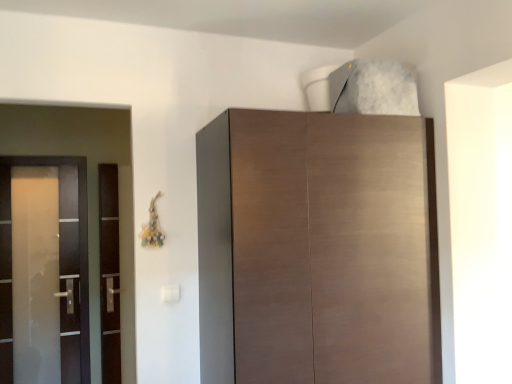
Find the location of a particular element. This screenshot has height=384, width=512. matte brown cabinet at upper center is located at coordinates (317, 249).

This screenshot has height=384, width=512. Describe the element at coordinates (109, 273) in the screenshot. I see `transparent glass door at left, which is counted as the 2th screen door, starting from the left` at that location.

Find the location of a particular element. Image resolution: width=512 pixels, height=384 pixels. matte brown cabinet at upper center is located at coordinates (317, 249).

Where is `screen door on the right of satin glass screen door at left, positioned as the first screen door in left-to-right order`? The width and height of the screenshot is (512, 384). screen door on the right of satin glass screen door at left, positioned as the first screen door in left-to-right order is located at coordinates (109, 273).

Considering the positions of objects transparent glass door at left, which is counted as the 2th screen door, starting from the left, and satin glass screen door at left, positioned as the first screen door in left-to-right order, in the image provided, who is more to the right, transparent glass door at left, which is counted as the 2th screen door, starting from the left, or satin glass screen door at left, positioned as the first screen door in left-to-right order,?

transparent glass door at left, which is counted as the 2th screen door, starting from the left.

Which point is more distant from viewer, (106, 366) or (28, 269)?

The point (106, 366) is more distant.

Is satin glass screen door at left, marked as the 2th screen door in a right-to-left arrangement, spatially inside transparent glass door at left, which is the 1th screen door in right-to-left order, or outside of it?

satin glass screen door at left, marked as the 2th screen door in a right-to-left arrangement, is not enclosed by transparent glass door at left, which is the 1th screen door in right-to-left order.

You are a GUI agent. You are given a task and a screenshot of the screen. Output one action in this format:
    pyautogui.click(x=<x>, y=<y>)
    Task: Click on the screen door below the satin glass screen door at left, marked as the 2th screen door in a right-to-left arrangement (from a real-world perspective)
    This screenshot has width=512, height=384.
    Given the screenshot: What is the action you would take?
    pyautogui.click(x=109, y=273)

Which is more distant, (55,267) or (106,339)?

The point (106,339) is more distant.

Is satin glass screen door at left, marked as the 2th screen door in a right-to-left arrangement, thinner than transparent glass door at left, which is the 1th screen door in right-to-left order?

Yes, satin glass screen door at left, marked as the 2th screen door in a right-to-left arrangement, is thinner than transparent glass door at left, which is the 1th screen door in right-to-left order.

Can you tell me how much matte brown cabinet at upper center and transparent glass door at left, which is counted as the 2th screen door, starting from the left, differ in facing direction?

There is a 7.27-degree angle between the facing directions of matte brown cabinet at upper center and transparent glass door at left, which is counted as the 2th screen door, starting from the left.

From the image's perspective, does matte brown cabinet at upper center appear lower than transparent glass door at left, which is counted as the 2th screen door, starting from the left?

No.

Looking at their sizes, would you say matte brown cabinet at upper center is wider or thinner than transparent glass door at left, which is the 1th screen door in right-to-left order?

matte brown cabinet at upper center is wider than transparent glass door at left, which is the 1th screen door in right-to-left order.

Is matte brown cabinet at upper center with transparent glass door at left, which is the 1th screen door in right-to-left order?

No, matte brown cabinet at upper center is not making contact with transparent glass door at left, which is the 1th screen door in right-to-left order.

Which of these two, satin glass screen door at left, positioned as the first screen door in left-to-right order, or matte brown cabinet at upper center, is thinner?

satin glass screen door at left, positioned as the first screen door in left-to-right order.

Is point (28, 235) farther from viewer compared to point (287, 196)?

That is True.

From the image's perspective, is satin glass screen door at left, positioned as the first screen door in left-to-right order, on top of matte brown cabinet at upper center?

Actually, satin glass screen door at left, positioned as the first screen door in left-to-right order, appears below matte brown cabinet at upper center in the image.

Does satin glass screen door at left, marked as the 2th screen door in a right-to-left arrangement, come behind matte brown cabinet at upper center?

Yes, the depth of satin glass screen door at left, marked as the 2th screen door in a right-to-left arrangement, is greater than that of matte brown cabinet at upper center.

Is transparent glass door at left, which is the 1th screen door in right-to-left order, further to the viewer compared to matte brown cabinet at upper center?

Yes, transparent glass door at left, which is the 1th screen door in right-to-left order, is behind matte brown cabinet at upper center.

How different are the orientations of transparent glass door at left, which is counted as the 2th screen door, starting from the left, and matte brown cabinet at upper center in degrees?

transparent glass door at left, which is counted as the 2th screen door, starting from the left, and matte brown cabinet at upper center are facing 7.27 degrees away from each other.

Who is bigger, transparent glass door at left, which is counted as the 2th screen door, starting from the left, or matte brown cabinet at upper center?

Bigger between the two is matte brown cabinet at upper center.

Considering the points (113, 204) and (429, 239), which point is behind, point (113, 204) or point (429, 239)?

The point (113, 204) is behind.

Is matte brown cabinet at upper center to the left of satin glass screen door at left, marked as the 2th screen door in a right-to-left arrangement, from the viewer's perspective?

In fact, matte brown cabinet at upper center is to the right of satin glass screen door at left, marked as the 2th screen door in a right-to-left arrangement.

Between matte brown cabinet at upper center and satin glass screen door at left, marked as the 2th screen door in a right-to-left arrangement, which one has smaller width?

Thinner between the two is satin glass screen door at left, marked as the 2th screen door in a right-to-left arrangement.

This screenshot has height=384, width=512. In order to click on cupboard that is above the satin glass screen door at left, marked as the 2th screen door in a right-to-left arrangement (from the image's perspective) in this screenshot , I will do [317, 249].

From a real-world perspective, is matte brown cabinet at upper center physically below satin glass screen door at left, marked as the 2th screen door in a right-to-left arrangement?

No, from a real-world perspective, matte brown cabinet at upper center is not beneath satin glass screen door at left, marked as the 2th screen door in a right-to-left arrangement.

This screenshot has height=384, width=512. I want to click on screen door located on the right of satin glass screen door at left, marked as the 2th screen door in a right-to-left arrangement, so (109, 273).

Where is `screen door that is above the transparent glass door at left, which is counted as the 2th screen door, starting from the left (from the image's perspective)`? This screenshot has width=512, height=384. screen door that is above the transparent glass door at left, which is counted as the 2th screen door, starting from the left (from the image's perspective) is located at coordinates (35, 274).

In the scene shown: From the image, which object appears to be nearer to matte brown cabinet at upper center, transparent glass door at left, which is counted as the 2th screen door, starting from the left, or satin glass screen door at left, marked as the 2th screen door in a right-to-left arrangement?

transparent glass door at left, which is counted as the 2th screen door, starting from the left, is closer to matte brown cabinet at upper center.

From the image, which object appears to be farther from satin glass screen door at left, marked as the 2th screen door in a right-to-left arrangement, transparent glass door at left, which is counted as the 2th screen door, starting from the left, or matte brown cabinet at upper center?

matte brown cabinet at upper center is positioned further to the anchor satin glass screen door at left, marked as the 2th screen door in a right-to-left arrangement.

Considering their positions, is matte brown cabinet at upper center positioned further to satin glass screen door at left, positioned as the first screen door in left-to-right order, than transparent glass door at left, which is counted as the 2th screen door, starting from the left?

matte brown cabinet at upper center is positioned further to the anchor satin glass screen door at left, positioned as the first screen door in left-to-right order.

Considering their positions, is matte brown cabinet at upper center positioned closer to transparent glass door at left, which is counted as the 2th screen door, starting from the left, than satin glass screen door at left, positioned as the first screen door in left-to-right order?

Based on the image, satin glass screen door at left, positioned as the first screen door in left-to-right order, appears to be nearer to transparent glass door at left, which is counted as the 2th screen door, starting from the left.

When comparing their distances from matte brown cabinet at upper center, does satin glass screen door at left, marked as the 2th screen door in a right-to-left arrangement, or transparent glass door at left, which is counted as the 2th screen door, starting from the left, seem further?

The object further to matte brown cabinet at upper center is satin glass screen door at left, marked as the 2th screen door in a right-to-left arrangement.

Looking at the image, which one is located closer to transparent glass door at left, which is counted as the 2th screen door, starting from the left, satin glass screen door at left, positioned as the first screen door in left-to-right order, or matte brown cabinet at upper center?

satin glass screen door at left, positioned as the first screen door in left-to-right order, is positioned closer to the anchor transparent glass door at left, which is counted as the 2th screen door, starting from the left.

Image resolution: width=512 pixels, height=384 pixels. I want to click on screen door between satin glass screen door at left, positioned as the first screen door in left-to-right order, and matte brown cabinet at upper center, in the horizontal direction, so click(x=109, y=273).